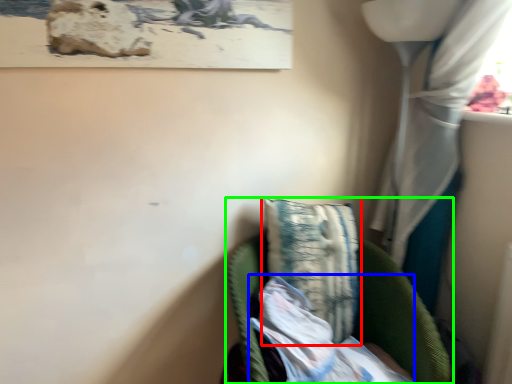
Question: Which object is positioned closest to pillow (highlighted by a red box)? Select from wrapping paper (highlighted by a blue box) and furniture (highlighted by a green box).

Choices:
 (A) wrapping paper
 (B) furniture

Answer: (B)